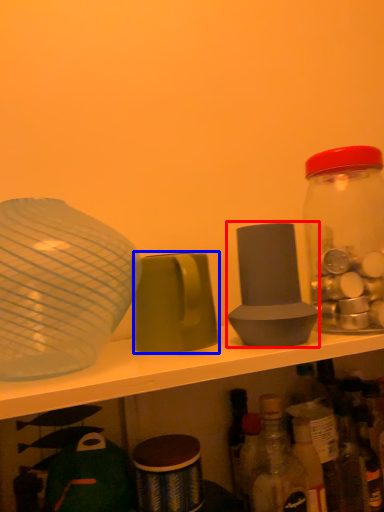
Question: Which object appears closest to the camera in this image, tableware (highlighted by a red box) or tableware (highlighted by a blue box)?

Choices:
 (A) tableware
 (B) tableware

Answer: (B)